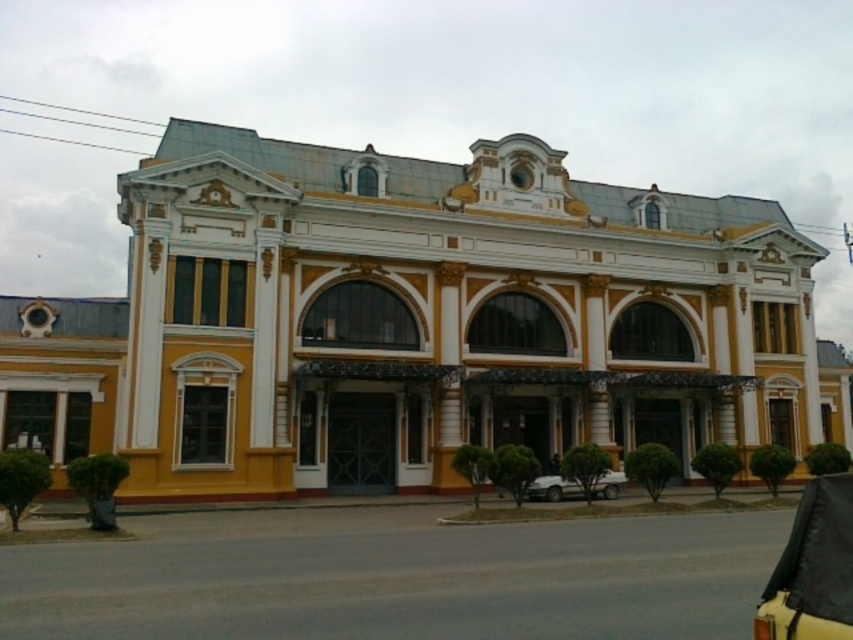
You are driving a car and need to park in a tight space near the grand building. You see the yellow matte car at lower right and the white matte car at lower center. Which car takes up more space in the parking area?

The yellow matte car at lower right has a larger size compared to the white matte car at lower center, so it takes up more space in the parking area.

From the picture: You are standing in front of the grand building and want to determine the relative positions of two points marked on the facade. Which point is closer to you, point at coordinate (849, 589) or point at coordinate (531, 492)?

→ Point at coordinate (849, 589) is closer to the viewer than point at coordinate (531, 492).

You are standing in front of the grand building and notice two cars parked nearby. The yellow matte car at lower right and the white matte car at lower center. Which car is positioned closer to you?

The yellow matte car at lower right is closer to the viewer than the white matte car at lower center.